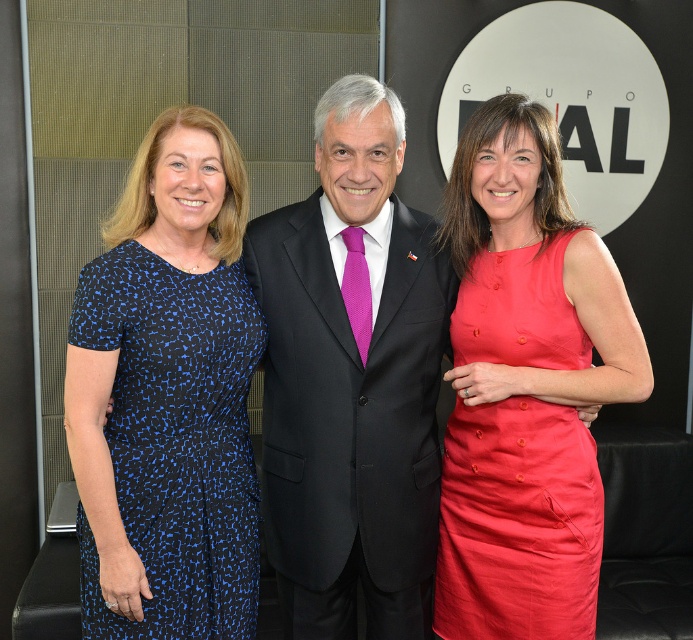
From the picture: Is blue printed fabric dress at left positioned behind matte red dress at right?

No, blue printed fabric dress at left is closer to the viewer.

Does blue printed fabric dress at left have a greater width compared to matte red dress at right?

Correct, the width of blue printed fabric dress at left exceeds that of matte red dress at right.

Is point (139, 358) more distant than point (595, 605)?

No, it is not.

Where is `blue printed fabric dress at left`? Image resolution: width=693 pixels, height=640 pixels. blue printed fabric dress at left is located at coordinates (x=175, y=442).

Between black suit at center and blue printed fabric dress at left, which one has less height?

With less height is blue printed fabric dress at left.

Is black suit at center below blue printed fabric dress at left?

Actually, black suit at center is above blue printed fabric dress at left.

Which is behind, point (367, 532) or point (211, 346)?

The point (367, 532) is behind.

The image size is (693, 640). What are the coordinates of `black suit at center` in the screenshot? It's located at (351, 380).

Is point (414, 547) positioned in front of point (520, 516)?

That is False.

In the scene shown: Is black suit at center bigger than matte red dress at right?

Yes, black suit at center is bigger than matte red dress at right.

The width and height of the screenshot is (693, 640). In order to click on black suit at center in this screenshot , I will do `click(351, 380)`.